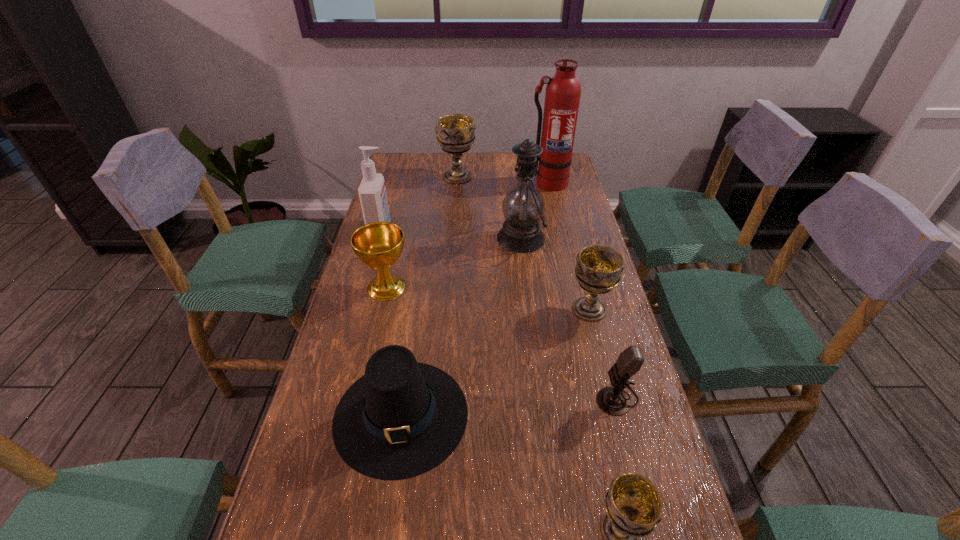
Where is `vacant space at the right edge`? Image resolution: width=960 pixels, height=540 pixels. vacant space at the right edge is located at coordinates (583, 205).

Locate an element on the screen. vacant area at the far left corner is located at coordinates (403, 166).

At what (x,y) coordinates should I click in order to perform the action: click on free space at the far right corner. Please return your answer as a coordinate pair (x, y). Looking at the image, I should click on 572,171.

The image size is (960, 540). In order to click on unoccupied area between the seventh shortest object and the microphone in this screenshot , I will do `click(499, 313)`.

Where is `free space that is in between the gray hat and the second farthest white chalice`? The height and width of the screenshot is (540, 960). free space that is in between the gray hat and the second farthest white chalice is located at coordinates (495, 362).

In order to click on unoccupied position between the gray hat and the oil lamp in this screenshot , I will do `click(461, 326)`.

Identify which object is the fifth nearest to the leftmost chalice. Please provide its 2D coordinates. Your answer should be formatted as a tuple, i.e. [(x, y)], where the tuple contains the x and y coordinates of a point satisfying the conditions above.

[(455, 133)]

The image size is (960, 540). Find the location of `the fifth closest object relative to the hat`. the fifth closest object relative to the hat is located at coordinates (523, 207).

Select which chalice is the third closest to the tallest object. Please provide its 2D coordinates. Your answer should be formatted as a tuple, i.e. [(x, y)], where the tuple contains the x and y coordinates of a point satisfying the conditions above.

[(378, 245)]

Identify which chalice is the second closest to the leftmost chalice. Please provide its 2D coordinates. Your answer should be formatted as a tuple, i.e. [(x, y)], where the tuple contains the x and y coordinates of a point satisfying the conditions above.

[(455, 133)]